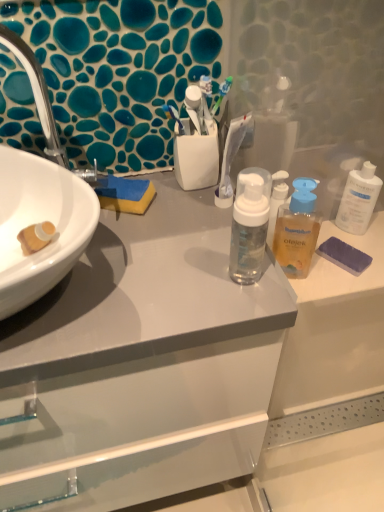
Question: Does white glossy cabinet at center have a lesser width compared to translucent plastic bottle at center?

Choices:
 (A) yes
 (B) no

Answer: (B)

Question: From the image's perspective, is white glossy cabinet at center located beneath translucent plastic bottle at center?

Choices:
 (A) yes
 (B) no

Answer: (A)

Question: Is white glossy cabinet at center directly adjacent to translucent plastic bottle at center?

Choices:
 (A) yes
 (B) no

Answer: (B)

Question: Considering the relative sizes of white glossy cabinet at center and translucent plastic bottle at center in the image provided, is white glossy cabinet at center shorter than translucent plastic bottle at center?

Choices:
 (A) no
 (B) yes

Answer: (A)

Question: From a real-world perspective, is white glossy cabinet at center on translucent plastic bottle at center?

Choices:
 (A) yes
 (B) no

Answer: (B)

Question: Considering the positions of point (302, 239) and point (350, 254), is point (302, 239) closer or farther from the camera than point (350, 254)?

Choices:
 (A) farther
 (B) closer

Answer: (A)

Question: Would you say translucent plastic bottle at center is to the left or to the right of purple sponge at right in the picture?

Choices:
 (A) left
 (B) right

Answer: (A)

Question: Is translucent plastic bottle at center taller or shorter than purple sponge at right?

Choices:
 (A) short
 (B) tall

Answer: (B)

Question: Considering the positions of translucent plastic bottle at center and purple sponge at right in the image, is translucent plastic bottle at center bigger or smaller than purple sponge at right?

Choices:
 (A) small
 (B) big

Answer: (B)

Question: From the image's perspective, is white plastic bottle at upper right positioned above or below white glossy cabinet at center?

Choices:
 (A) above
 (B) below

Answer: (A)

Question: Looking at the image, does white plastic bottle at upper right seem bigger or smaller compared to white glossy cabinet at center?

Choices:
 (A) big
 (B) small

Answer: (B)

Question: Considering their positions, is white plastic bottle at upper right located in front of or behind white glossy cabinet at center?

Choices:
 (A) front
 (B) behind

Answer: (B)

Question: In terms of width, does white plastic bottle at upper right look wider or thinner when compared to white glossy cabinet at center?

Choices:
 (A) wide
 (B) thin

Answer: (B)

Question: From the image's perspective, is white glossy cabinet at center positioned above or below purple sponge at right?

Choices:
 (A) below
 (B) above

Answer: (A)

Question: Based on their sizes in the image, would you say white glossy cabinet at center is bigger or smaller than purple sponge at right?

Choices:
 (A) big
 (B) small

Answer: (A)